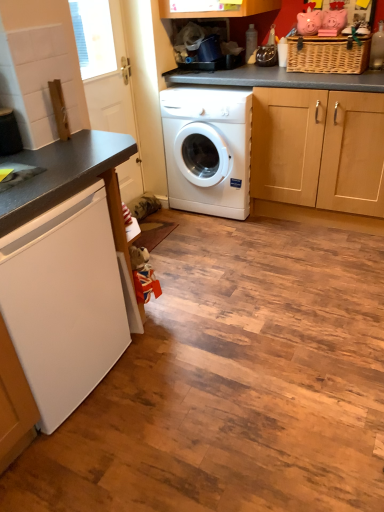
Question: From a real-world perspective, is white glossy door at upper left positioned above or below woven brown basket at upper right?

Choices:
 (A) above
 (B) below

Answer: (B)

Question: Looking at their shapes, would you say white glossy door at upper left is wider or thinner than woven brown basket at upper right?

Choices:
 (A) thin
 (B) wide

Answer: (A)

Question: Estimate the real-world distances between objects in this image. Which object is farther from the white glossy washing machine at center, arranged as the second washing machine when viewed from the front?

Choices:
 (A) white glossy door at upper left
 (B) white matte refrigerator at lower left, acting as the first washing machine starting from the left
 (C) woven brown basket at upper right

Answer: (B)

Question: Which of these objects is positioned closest to the white glossy washing machine at center, arranged as the second washing machine when viewed from the left?

Choices:
 (A) white matte refrigerator at lower left, positioned as the 2th washing machine in top-to-bottom order
 (B) woven brown basket at upper right
 (C) white glossy door at upper left

Answer: (C)